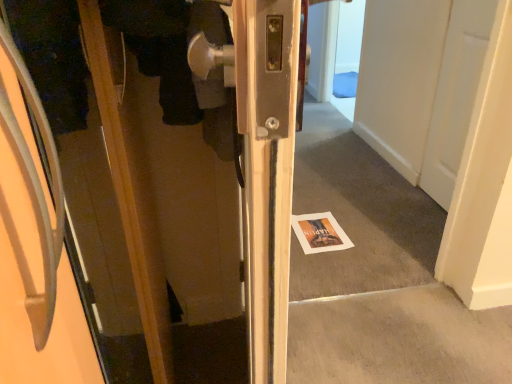
Question: Can you confirm if white paper magazine at center is thinner than matte wood door at left?

Choices:
 (A) no
 (B) yes

Answer: (B)

Question: Can you see white paper magazine at center touching matte wood door at left?

Choices:
 (A) yes
 (B) no

Answer: (B)

Question: Is white paper magazine at center facing away from matte wood door at left?

Choices:
 (A) yes
 (B) no

Answer: (B)

Question: From the image's perspective, is white paper magazine at center on top of matte wood door at left?

Choices:
 (A) no
 (B) yes

Answer: (B)

Question: Is white paper magazine at center not near matte wood door at left?

Choices:
 (A) no
 (B) yes

Answer: (B)

Question: Can you confirm if white paper magazine at center is shorter than matte wood door at left?

Choices:
 (A) no
 (B) yes

Answer: (B)

Question: Does matte wood door at left have a greater width compared to white paper magazine at center?

Choices:
 (A) yes
 (B) no

Answer: (A)

Question: Does matte wood door at left have a greater height compared to white paper magazine at center?

Choices:
 (A) no
 (B) yes

Answer: (B)

Question: Considering the relative sizes of matte wood door at left and white paper magazine at center in the image provided, is matte wood door at left smaller than white paper magazine at center?

Choices:
 (A) no
 (B) yes

Answer: (A)

Question: Is matte wood door at left completely or partially outside of white paper magazine at center?

Choices:
 (A) yes
 (B) no

Answer: (A)

Question: From a real-world perspective, does matte wood door at left stand above white paper magazine at center?

Choices:
 (A) no
 (B) yes

Answer: (B)

Question: From the image's perspective, would you say matte wood door at left is shown under white paper magazine at center?

Choices:
 (A) yes
 (B) no

Answer: (A)

Question: Is white paper magazine at center wider or thinner than matte wood door at left?

Choices:
 (A) wide
 (B) thin

Answer: (B)